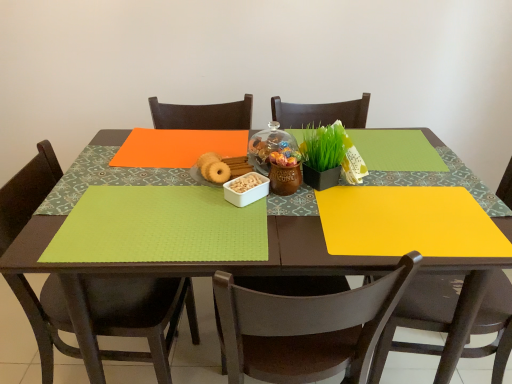
The width and height of the screenshot is (512, 384). What do you see at coordinates (305, 328) in the screenshot?
I see `brown wooden chair at center, which is counted as the 2th chair, starting from the left` at bounding box center [305, 328].

What is the approximate width of matte wood table at center?

The width of matte wood table at center is 28.39 inches.

What do you see at coordinates (159, 227) in the screenshot?
I see `lime green fabric placemat at lower left` at bounding box center [159, 227].

At what (x,y) coordinates should I click in order to perform the action: click on lime green fabric placemat at lower left. Please return your answer as a coordinate pair (x, y). Looking at the image, I should click on [x=159, y=227].

Measure the distance between point (x=282, y=139) and camera.

They are 3.52 feet apart.

This screenshot has width=512, height=384. What are the coordinates of `brown wooden chair at center, positioned as the second chair in right-to-left order` in the screenshot? It's located at (305, 328).

Considering the sizes of transparent glass jar at center and matte wood table at center in the image, is transparent glass jar at center wider or thinner than matte wood table at center?

Clearly, transparent glass jar at center has less width compared to matte wood table at center.

In the scene shown: Does transparent glass jar at center have a greater height compared to matte wood table at center?

In fact, transparent glass jar at center may be shorter than matte wood table at center.

Is transparent glass jar at center located outside matte wood table at center?

Absolutely, transparent glass jar at center is external to matte wood table at center.

Does point (269, 136) lie behind point (53, 224)?

Yes, it is.

From a real-world perspective, is matte brown chair at lower right, placed as the 3th chair when sorted from left to right, positioned above or below green matte plant at center?

matte brown chair at lower right, placed as the 3th chair when sorted from left to right, is situated lower than green matte plant at center in the real world.

From the image's perspective, is matte brown chair at lower right, placed as the 3th chair when sorted from left to right, positioned above or below green matte plant at center?

From the image's perspective, matte brown chair at lower right, placed as the 3th chair when sorted from left to right, appears below green matte plant at center.

Can you confirm if matte brown chair at lower right, positioned as the 1th chair in right-to-left order, is shorter than green matte plant at center?

No, matte brown chair at lower right, positioned as the 1th chair in right-to-left order, is not shorter than green matte plant at center.

Considering the relative sizes of matte brown chair at lower right, placed as the 3th chair when sorted from left to right, and green matte plant at center in the image provided, is matte brown chair at lower right, placed as the 3th chair when sorted from left to right, bigger than green matte plant at center?

Yes, matte brown chair at lower right, placed as the 3th chair when sorted from left to right, is bigger than green matte plant at center.

Is matte brown chair at lower right, placed as the 3th chair when sorted from left to right, beside matte wood table at center?

No, matte brown chair at lower right, placed as the 3th chair when sorted from left to right, is not touching matte wood table at center.

Measure the distance between matte brown chair at lower right, placed as the 3th chair when sorted from left to right, and matte wood table at center.

matte brown chair at lower right, placed as the 3th chair when sorted from left to right, is 11.34 inches away from matte wood table at center.

From the image's perspective, is matte brown chair at lower right, placed as the 3th chair when sorted from left to right, above or below matte wood table at center?

Clearly, from the image's perspective, matte brown chair at lower right, placed as the 3th chair when sorted from left to right, is below matte wood table at center.

Relative to matte wood table at center, is matte brown chair at lower right, placed as the 3th chair when sorted from left to right, in front or behind?

matte brown chair at lower right, placed as the 3th chair when sorted from left to right, is behind matte wood table at center.

From a real-world perspective, is green matte plant at center positioned over matte black chair at lower left, the first chair when ordered from left to right, based on gravity?

Yes, from a real-world perspective, green matte plant at center is on top of matte black chair at lower left, the first chair when ordered from left to right.

Considering the sizes of objects green matte plant at center and matte black chair at lower left, which ranks as the 3th chair in right-to-left order, in the image provided, who is bigger, green matte plant at center or matte black chair at lower left, which ranks as the 3th chair in right-to-left order,?

Bigger between the two is matte black chair at lower left, which ranks as the 3th chair in right-to-left order.

Which object is closer to the camera, green matte plant at center or matte black chair at lower left, the first chair when ordered from left to right?

matte black chair at lower left, the first chair when ordered from left to right, is closer to the camera.

Is green matte plant at center situated inside matte black chair at lower left, which ranks as the 3th chair in right-to-left order, or outside?

green matte plant at center is not inside matte black chair at lower left, which ranks as the 3th chair in right-to-left order, it's outside.

Between matte brown chair at lower right, placed as the 3th chair when sorted from left to right, and lime green fabric placemat at lower left, which one has smaller width?

Thinner between the two is lime green fabric placemat at lower left.

Are matte brown chair at lower right, placed as the 3th chair when sorted from left to right, and lime green fabric placemat at lower left located far from each other?

No.

From the image's perspective, which one is positioned higher, matte brown chair at lower right, placed as the 3th chair when sorted from left to right, or lime green fabric placemat at lower left?

From the image's view, lime green fabric placemat at lower left is above.

Based on their sizes in the image, would you say lime green fabric placemat at lower left is bigger or smaller than matte black chair at lower left, the first chair when ordered from left to right?

Considering their sizes, lime green fabric placemat at lower left takes up less space than matte black chair at lower left, the first chair when ordered from left to right.

From the image's perspective, is lime green fabric placemat at lower left above matte black chair at lower left, the first chair when ordered from left to right?

Yes, from the image's perspective, lime green fabric placemat at lower left is above matte black chair at lower left, the first chair when ordered from left to right.

Which is behind, lime green fabric placemat at lower left or matte black chair at lower left, which ranks as the 3th chair in right-to-left order?

matte black chair at lower left, which ranks as the 3th chair in right-to-left order, is behind.

Is matte wood table at center facing away from matte black chair at lower left, the first chair when ordered from left to right?

matte wood table at center does not have its back to matte black chair at lower left, the first chair when ordered from left to right.

Considering the positions of points (327, 267) and (121, 289), is point (327, 267) closer to camera compared to point (121, 289)?

Yes, it is in front of point (121, 289).

Looking at this image, from their relative heights in the image, would you say matte wood table at center is taller or shorter than matte black chair at lower left, which ranks as the 3th chair in right-to-left order?

Clearly, matte wood table at center is shorter compared to matte black chair at lower left, which ranks as the 3th chair in right-to-left order.

The image size is (512, 384). What are the coordinates of `glass jar above the matte wood table at center (from a real-world perspective)` in the screenshot? It's located at [x=269, y=146].

Image resolution: width=512 pixels, height=384 pixels. Identify the location of chair on the right of green matte plant at center. (418, 317).

When comparing their distances from matte black chair at lower left, the first chair when ordered from left to right, does transparent glass jar at center or matte wood table at center seem closer?

Among the two, matte wood table at center is located nearer to matte black chair at lower left, the first chair when ordered from left to right.

When comparing their distances from lime green fabric placemat at lower left, does matte wood table at center or matte black chair at lower left, which ranks as the 3th chair in right-to-left order, seem closer?

Among the two, matte wood table at center is located nearer to lime green fabric placemat at lower left.

Considering their positions, is lime green fabric placemat at lower left positioned further to matte black chair at lower left, the first chair when ordered from left to right, than matte brown chair at lower right, placed as the 3th chair when sorted from left to right?

matte brown chair at lower right, placed as the 3th chair when sorted from left to right, is further to matte black chair at lower left, the first chair when ordered from left to right.

Looking at the image, which one is located closer to matte brown chair at lower right, placed as the 3th chair when sorted from left to right, green matte plant at center or transparent glass jar at center?

green matte plant at center.

Estimate the real-world distances between objects in this image. Which object is closer to green matte plant at center, transparent glass jar at center or matte black chair at lower left, which ranks as the 3th chair in right-to-left order?

transparent glass jar at center.

When comparing their distances from lime green fabric placemat at lower left, does matte black chair at lower left, the first chair when ordered from left to right, or matte wood table at center seem further?

Based on the image, matte black chair at lower left, the first chair when ordered from left to right, appears to be further to lime green fabric placemat at lower left.

Estimate the real-world distances between objects in this image. Which object is closer to lime green fabric placemat at lower left, matte wood table at center or matte brown chair at lower right, placed as the 3th chair when sorted from left to right?

matte wood table at center lies closer to lime green fabric placemat at lower left than the other object.

From the picture: Estimate the real-world distances between objects in this image. Which object is closer to brown wooden chair at center, positioned as the second chair in right-to-left order, transparent glass jar at center or matte black chair at lower left, the first chair when ordered from left to right?

transparent glass jar at center is positioned closer to the anchor brown wooden chair at center, positioned as the second chair in right-to-left order.

I want to click on plant between transparent glass jar at center and brown wooden chair at center, which is counted as the 2th chair, starting from the left, from top to bottom, so click(325, 147).

Identify the location of table between lime green fabric placemat at lower left and matte brown chair at lower right, placed as the 3th chair when sorted from left to right, from left to right. Image resolution: width=512 pixels, height=384 pixels. (307, 252).

This screenshot has height=384, width=512. I want to click on chair located between lime green fabric placemat at lower left and matte brown chair at lower right, placed as the 3th chair when sorted from left to right, in the left-right direction, so click(305, 328).

Locate an element on the screen. This screenshot has height=384, width=512. place mat between green matte plant at center and matte wood table at center vertically is located at coordinates (159, 227).